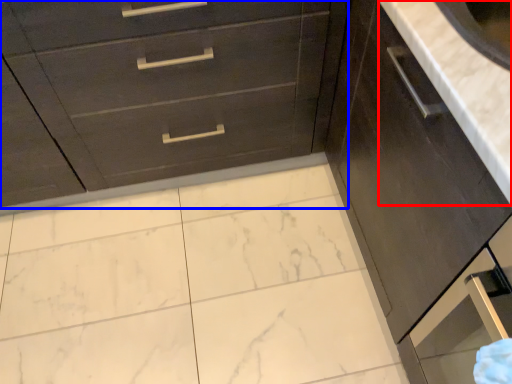
Question: Which object appears farthest to the camera in this image, counter top (highlighted by a red box) or chest of drawers (highlighted by a blue box)?

Choices:
 (A) counter top
 (B) chest of drawers

Answer: (B)